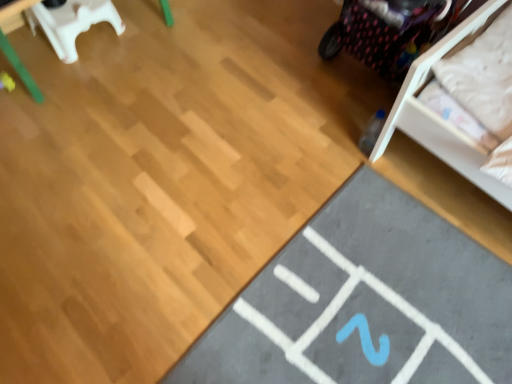
This screenshot has height=384, width=512. Describe the element at coordinates (72, 23) in the screenshot. I see `white plastic chair at upper left` at that location.

Find the location of `white plastic chair at upper left`. white plastic chair at upper left is located at coordinates (72, 23).

Describe the element at coordinates (365, 302) in the screenshot. I see `gray rubber yoga mat at lower right` at that location.

Measure the distance between point (375, 382) and camera.

Point (375, 382) is 1.23 meters from camera.

At what (x,y) coordinates should I click in order to perform the action: click on gray rubber yoga mat at lower right. Please return your answer as a coordinate pair (x, y). This screenshot has height=384, width=512. Looking at the image, I should click on (365, 302).

Locate an element on the screen. The height and width of the screenshot is (384, 512). white plastic chair at upper left is located at coordinates (72, 23).

From the picture: Does gray rubber yoga mat at lower right appear on the right side of white plastic chair at upper left?

Yes.

Which object is closer to the camera taking this photo, gray rubber yoga mat at lower right or white plastic chair at upper left?

gray rubber yoga mat at lower right is more forward.

Which is more distant, (x=311, y=309) or (x=82, y=21)?

The point (x=82, y=21) is farther.

From the image's perspective, is gray rubber yoga mat at lower right above white plastic chair at upper left?

No, from the image's perspective, gray rubber yoga mat at lower right is not on top of white plastic chair at upper left.

From a real-world perspective, between gray rubber yoga mat at lower right and white plastic chair at upper left, who is vertically lower?

gray rubber yoga mat at lower right, from a real-world perspective.

Is gray rubber yoga mat at lower right wider than white plastic chair at upper left?

Indeed, gray rubber yoga mat at lower right has a greater width compared to white plastic chair at upper left.

Considering the relative sizes of gray rubber yoga mat at lower right and white plastic chair at upper left in the image provided, is gray rubber yoga mat at lower right taller than white plastic chair at upper left?

Incorrect, the height of gray rubber yoga mat at lower right is not larger of that of white plastic chair at upper left.

Is gray rubber yoga mat at lower right bigger than white plastic chair at upper left?

Correct, gray rubber yoga mat at lower right is larger in size than white plastic chair at upper left.

Can white plastic chair at upper left be found inside gray rubber yoga mat at lower right?

No, white plastic chair at upper left is not surrounded by gray rubber yoga mat at lower right.

Would you say gray rubber yoga mat at lower right is a long distance from white plastic chair at upper left?

Yes, gray rubber yoga mat at lower right is far from white plastic chair at upper left.

Is gray rubber yoga mat at lower right oriented away from white plastic chair at upper left?

No, gray rubber yoga mat at lower right is not facing away from white plastic chair at upper left.

The height and width of the screenshot is (384, 512). I want to click on yoga mat on the right of white plastic chair at upper left, so click(365, 302).

Which is more to the right, white plastic chair at upper left or gray rubber yoga mat at lower right?

gray rubber yoga mat at lower right is more to the right.

Does white plastic chair at upper left come behind gray rubber yoga mat at lower right?

Yes, white plastic chair at upper left is behind gray rubber yoga mat at lower right.

Does point (75, 49) come farther from viewer compared to point (509, 317)?

Yes, it is behind point (509, 317).

From the image's perspective, between white plastic chair at upper left and gray rubber yoga mat at lower right, who is located below?

gray rubber yoga mat at lower right, from the image's perspective.

From a real-world perspective, which object stands above the other?

white plastic chair at upper left is physically above.

Looking at their sizes, would you say white plastic chair at upper left is wider or thinner than gray rubber yoga mat at lower right?

Clearly, white plastic chair at upper left has less width compared to gray rubber yoga mat at lower right.

Between white plastic chair at upper left and gray rubber yoga mat at lower right, which one has less height?

gray rubber yoga mat at lower right.

Who is bigger, white plastic chair at upper left or gray rubber yoga mat at lower right?

Bigger between the two is gray rubber yoga mat at lower right.

Is white plastic chair at upper left inside or outside of gray rubber yoga mat at lower right?

white plastic chair at upper left cannot be found inside gray rubber yoga mat at lower right.

Consider the image. Does white plastic chair at upper left touch gray rubber yoga mat at lower right?

They are not placed beside each other.

Could you tell me if white plastic chair at upper left is facing gray rubber yoga mat at lower right?

Yes, white plastic chair at upper left is facing gray rubber yoga mat at lower right.

Can you tell me how much white plastic chair at upper left and gray rubber yoga mat at lower right differ in facing direction?

The angle between the facing direction of white plastic chair at upper left and the facing direction of gray rubber yoga mat at lower right is 86.8 degrees.

Measure the distance between white plastic chair at upper left and gray rubber yoga mat at lower right.

A distance of 1.42 meters exists between white plastic chair at upper left and gray rubber yoga mat at lower right.

Find the location of `furniture on the left of gray rubber yoga mat at lower right`. furniture on the left of gray rubber yoga mat at lower right is located at coordinates (72, 23).

Locate an element on the screen. furniture located above the gray rubber yoga mat at lower right (from the image's perspective) is located at coordinates (72, 23).

This screenshot has width=512, height=384. In order to click on furniture above the gray rubber yoga mat at lower right (from a real-world perspective) in this screenshot , I will do `click(72, 23)`.